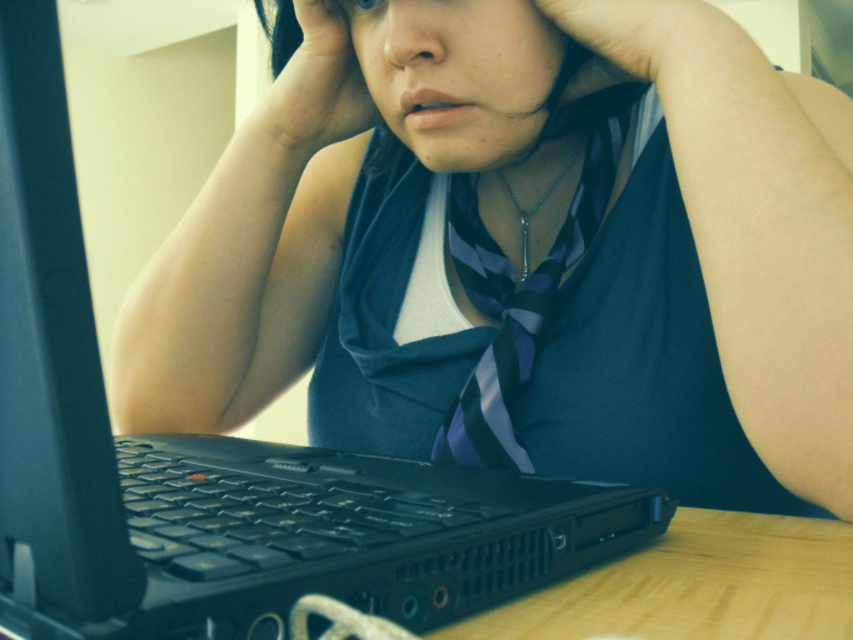
Does matte black laptop at lower left appear on the right side of striped silk tie at center?

No, matte black laptop at lower left is not to the right of striped silk tie at center.

Is matte black laptop at lower left further to camera compared to striped silk tie at center?

No, matte black laptop at lower left is closer to the viewer.

The width and height of the screenshot is (853, 640). Describe the element at coordinates (515, 262) in the screenshot. I see `matte black laptop at lower left` at that location.

Where is `matte black laptop at lower left`? Image resolution: width=853 pixels, height=640 pixels. matte black laptop at lower left is located at coordinates (515, 262).

The image size is (853, 640). What do you see at coordinates (514, 305) in the screenshot? I see `striped silk tie at center` at bounding box center [514, 305].

The width and height of the screenshot is (853, 640). What do you see at coordinates (514, 305) in the screenshot?
I see `striped silk tie at center` at bounding box center [514, 305].

Identify the location of striped silk tie at center. Image resolution: width=853 pixels, height=640 pixels. (514, 305).

Where is `striped silk tie at center`? The image size is (853, 640). striped silk tie at center is located at coordinates (514, 305).

Between striped silk tie at center and matte skin hand at center, which one is positioned higher?

matte skin hand at center is higher up.

Between point (579, 216) and point (264, 26), which one is positioned behind?

The point (264, 26) is more distant.

Image resolution: width=853 pixels, height=640 pixels. I want to click on striped silk tie at center, so click(x=514, y=305).